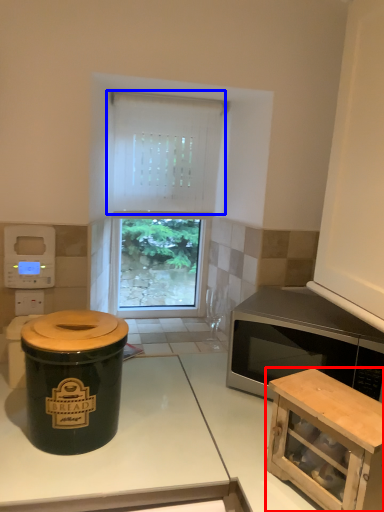
Question: Which object is further to the camera taking this photo, cabinetry (highlighted by a red box) or curtain (highlighted by a blue box)?

Choices:
 (A) cabinetry
 (B) curtain

Answer: (B)